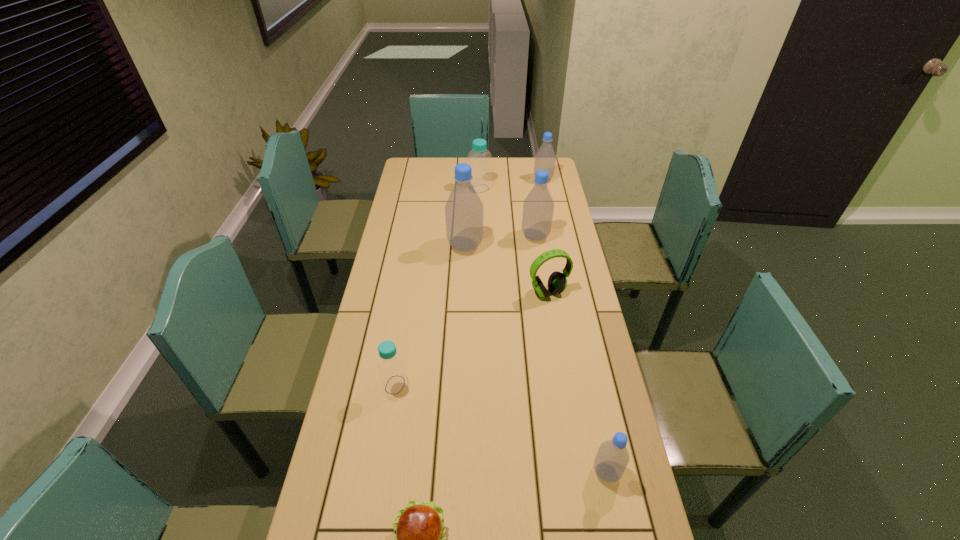
Find the location of a particular element. Image resolution: width=960 pixels, height=540 pixels. the closest gray bottle to the third biggest gray bottle is located at coordinates (x=538, y=207).

Locate which gray bottle is the closest to the farthest gray bottle. Please provide its 2D coordinates. Your answer should be formatted as a tuple, i.e. [(x, y)], where the tuple contains the x and y coordinates of a point satisfying the conditions above.

[(538, 207)]

Identify the location of vacant space that satisfies the following two spatial constraints: 1. on the back side of the left blue bottle; 2. on the left side of the farthest gray bottle. (428, 180).

Where is `vacant space that satisfies the following two spatial constraints: 1. on the front side of the second biggest gray bottle; 2. on the right side of the right blue bottle`? This screenshot has height=540, width=960. vacant space that satisfies the following two spatial constraints: 1. on the front side of the second biggest gray bottle; 2. on the right side of the right blue bottle is located at coordinates (479, 237).